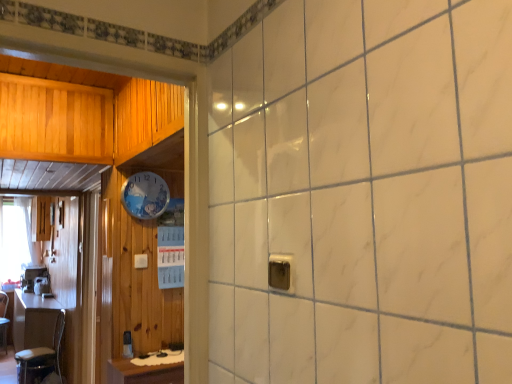
Question: Can you confirm if wooden table at left is taller than metallic silver chair at left?

Choices:
 (A) yes
 (B) no

Answer: (B)

Question: From the image's perspective, is wooden table at left below metallic silver chair at left?

Choices:
 (A) no
 (B) yes

Answer: (A)

Question: Can you confirm if wooden table at left is wider than metallic silver chair at left?

Choices:
 (A) no
 (B) yes

Answer: (A)

Question: Is wooden table at left closer to camera compared to metallic silver chair at left?

Choices:
 (A) yes
 (B) no

Answer: (A)

Question: Is the surface of wooden table at left in direct contact with metallic silver chair at left?

Choices:
 (A) yes
 (B) no

Answer: (B)

Question: From a real-world perspective, is white glossy clock at upper center positioned above or below white sheer curtain at left?

Choices:
 (A) below
 (B) above

Answer: (B)

Question: Do you think white glossy clock at upper center is within white sheer curtain at left, or outside of it?

Choices:
 (A) outside
 (B) inside

Answer: (A)

Question: From their relative heights in the image, would you say white glossy clock at upper center is taller or shorter than white sheer curtain at left?

Choices:
 (A) tall
 (B) short

Answer: (B)

Question: Looking at their shapes, would you say white glossy clock at upper center is wider or thinner than white sheer curtain at left?

Choices:
 (A) wide
 (B) thin

Answer: (B)

Question: From their relative heights in the image, would you say white sheer curtain at left is taller or shorter than metallic silver chair at left?

Choices:
 (A) tall
 (B) short

Answer: (A)

Question: Considering their positions, is white sheer curtain at left located in front of or behind metallic silver chair at left?

Choices:
 (A) behind
 (B) front

Answer: (A)

Question: Is white sheer curtain at left spatially inside metallic silver chair at left, or outside of it?

Choices:
 (A) outside
 (B) inside

Answer: (A)

Question: Considering the positions of white sheer curtain at left and metallic silver chair at left in the image, is white sheer curtain at left wider or thinner than metallic silver chair at left?

Choices:
 (A) wide
 (B) thin

Answer: (B)

Question: Is metallic silver outlet at center in front of or behind white glossy clock at upper center in the image?

Choices:
 (A) front
 (B) behind

Answer: (A)

Question: Looking at their shapes, would you say metallic silver outlet at center is wider or thinner than white glossy clock at upper center?

Choices:
 (A) thin
 (B) wide

Answer: (A)